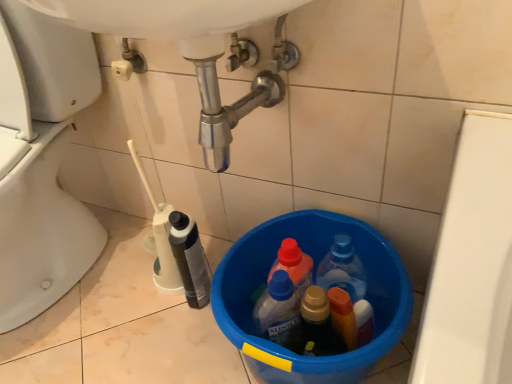
Question: From a real-world perspective, does white plastic bottle at lower left sit lower than blue plastic bucket at lower center?

Choices:
 (A) no
 (B) yes

Answer: (A)

Question: Is white plastic bottle at lower left to the left of blue plastic bucket at lower center from the viewer's perspective?

Choices:
 (A) no
 (B) yes

Answer: (B)

Question: From the image's perspective, is white plastic bottle at lower left on top of blue plastic bucket at lower center?

Choices:
 (A) no
 (B) yes

Answer: (B)

Question: Considering the relative sizes of white plastic bottle at lower left and blue plastic bucket at lower center in the image provided, is white plastic bottle at lower left wider than blue plastic bucket at lower center?

Choices:
 (A) no
 (B) yes

Answer: (A)

Question: Is white plastic bottle at lower left shorter than blue plastic bucket at lower center?

Choices:
 (A) no
 (B) yes

Answer: (A)

Question: Is white plastic bottle at lower left aimed at blue plastic bucket at lower center?

Choices:
 (A) no
 (B) yes

Answer: (A)

Question: Considering the relative positions of white glossy toilet at lower left and white plastic bottle at lower left in the image provided, is white glossy toilet at lower left to the left of white plastic bottle at lower left from the viewer's perspective?

Choices:
 (A) yes
 (B) no

Answer: (A)

Question: From the image's perspective, does white glossy toilet at lower left appear higher than white plastic bottle at lower left?

Choices:
 (A) no
 (B) yes

Answer: (B)

Question: Is white glossy toilet at lower left positioned before white plastic bottle at lower left?

Choices:
 (A) yes
 (B) no

Answer: (A)

Question: From a real-world perspective, is white glossy toilet at lower left physically below white plastic bottle at lower left?

Choices:
 (A) yes
 (B) no

Answer: (B)

Question: From a real-world perspective, is white glossy toilet at lower left located higher than white plastic bottle at lower left?

Choices:
 (A) yes
 (B) no

Answer: (A)

Question: Is white plastic bottle at lower left completely or partially inside white glossy toilet at lower left?

Choices:
 (A) yes
 (B) no

Answer: (B)

Question: Is white glossy toilet at lower left completely or partially outside of blue plastic bucket at lower center?

Choices:
 (A) yes
 (B) no

Answer: (A)